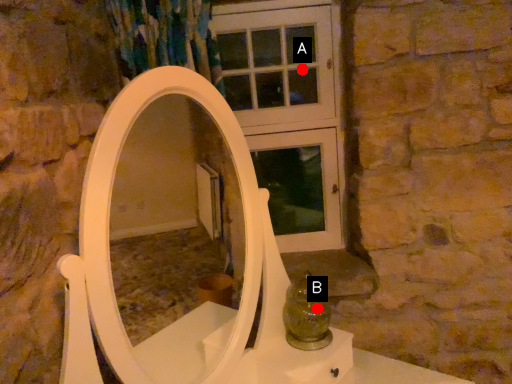
Question: Two points are circled on the image, labeled by A and B beside each circle. Which point is farther from the camera taking this photo?

Choices:
 (A) A is further
 (B) B is further

Answer: (A)